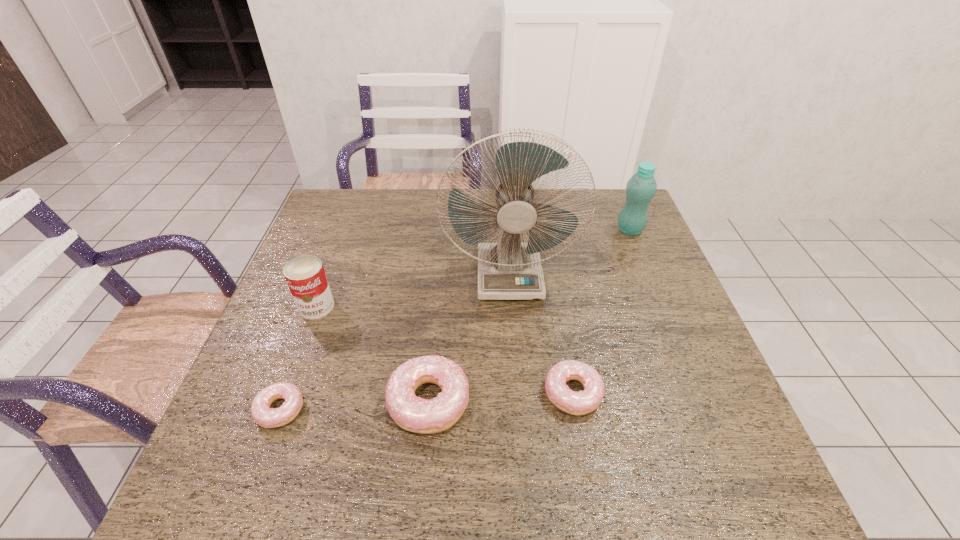
The width and height of the screenshot is (960, 540). I want to click on vacant point located on the back of the shortest object, so click(x=332, y=266).

You are a GUI agent. You are given a task and a screenshot of the screen. Output one action in this format:
    pyautogui.click(x=<x>, y=<y>)
    Task: Click on the free spot located on the left of the second doughnut from right to left
    Image resolution: width=960 pixels, height=540 pixels.
    Given the screenshot: What is the action you would take?
    pyautogui.click(x=346, y=401)

The height and width of the screenshot is (540, 960). What are the coordinates of `vacant area located 0.140m on the back of the rightmost doughnut` in the screenshot? It's located at (561, 322).

Identify the location of vacant position located 0.130m at the front cap of the farthest object. (574, 230).

Identify the location of vacant position located at the front cap of the farthest object. The image size is (960, 540). (584, 230).

What are the coordinates of `vacant space located at the front cap of the farthest object` in the screenshot? It's located at (590, 230).

What are the coordinates of `vacant space located 0.250m on the front label of the can` in the screenshot? It's located at tap(278, 410).

Image resolution: width=960 pixels, height=540 pixels. Identify the location of vacant area situated on the front-facing side of the tallest object. (514, 325).

Identify the location of object present at the far edge. The height and width of the screenshot is (540, 960). (641, 188).

Where is `doughnut at the left edge`? doughnut at the left edge is located at coordinates (266, 417).